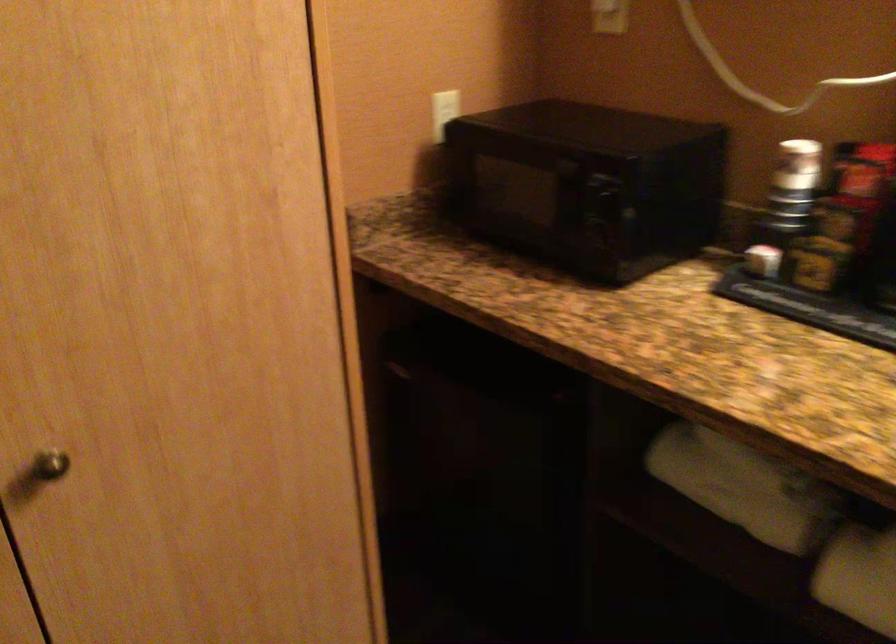
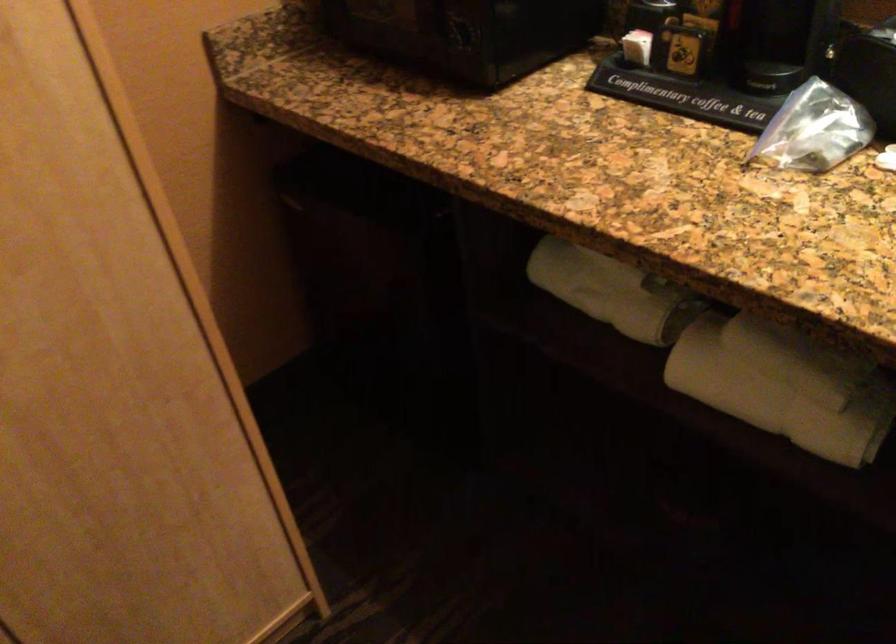
The point at (604, 234) is marked in the first image. Where is the corresponding point in the second image?

(466, 33)